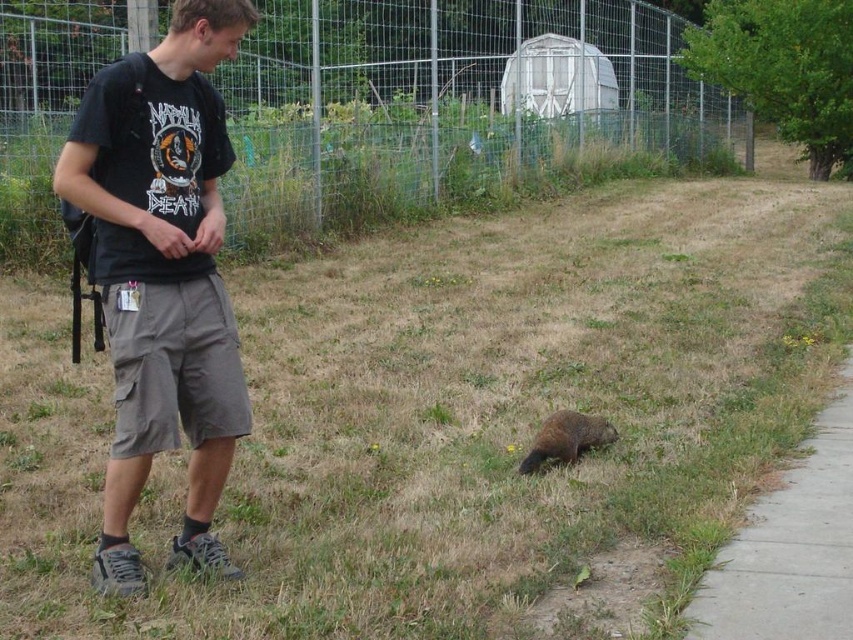
Question: Which object appears farthest from the camera in this image?

Choices:
 (A) black cotton t-shirt at upper left
 (B) concrete at lower right
 (C) metallic wire fence at upper center
 (D) brown furry groundhog at lower center

Answer: (C)

Question: Among these objects, which one is farthest from the camera?

Choices:
 (A) black cotton t-shirt at upper left
 (B) concrete at lower right

Answer: (A)

Question: Is metallic wire fence at upper center above brown furry groundhog at lower center?

Choices:
 (A) yes
 (B) no

Answer: (A)

Question: Where is concrete at lower right located in relation to brown furry groundhog at lower center in the image?

Choices:
 (A) above
 (B) below

Answer: (B)

Question: Which object appears closest to the camera in this image?

Choices:
 (A) concrete at lower right
 (B) brown furry groundhog at lower center
 (C) metallic wire fence at upper center
 (D) black cotton t-shirt at upper left

Answer: (A)

Question: Does metallic wire fence at upper center have a greater width compared to brown furry groundhog at lower center?

Choices:
 (A) no
 (B) yes

Answer: (B)